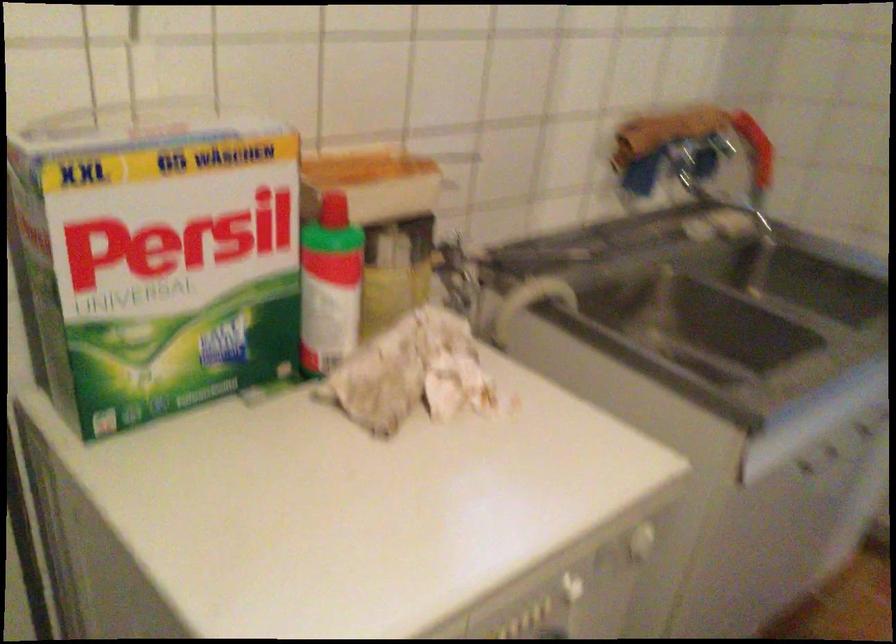
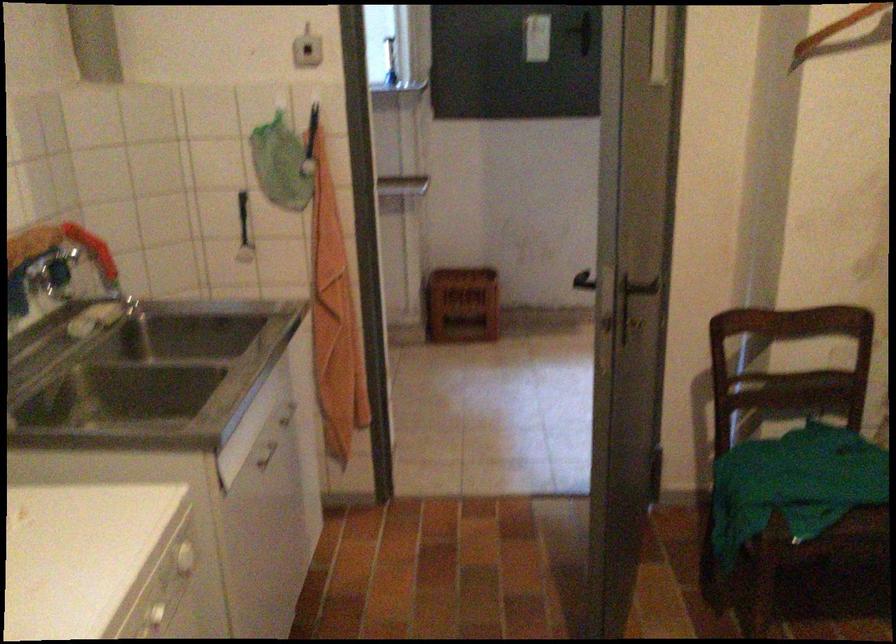
The point at (753, 138) is marked in the first image. Where is the corresponding point in the second image?

(91, 249)